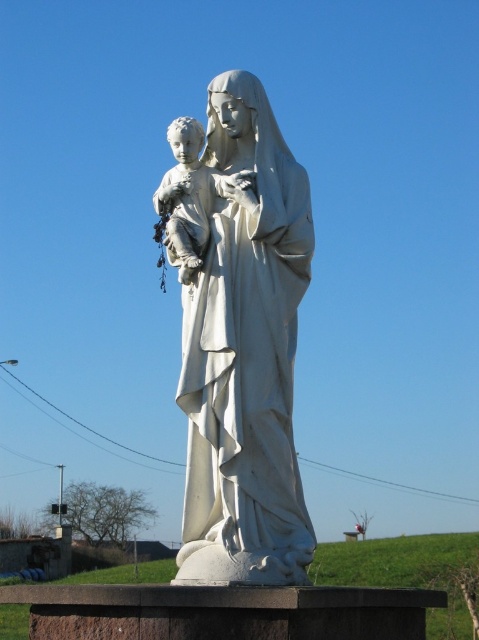
Question: Is white marble statue at center further to the viewer compared to white marble child at center?

Choices:
 (A) no
 (B) yes

Answer: (A)

Question: Does white marble statue at center have a lesser width compared to white marble child at center?

Choices:
 (A) no
 (B) yes

Answer: (A)

Question: Does white marble statue at center have a greater width compared to white marble child at center?

Choices:
 (A) no
 (B) yes

Answer: (B)

Question: Which point is farther to the camera?

Choices:
 (A) white marble statue at center
 (B) white marble child at center

Answer: (B)